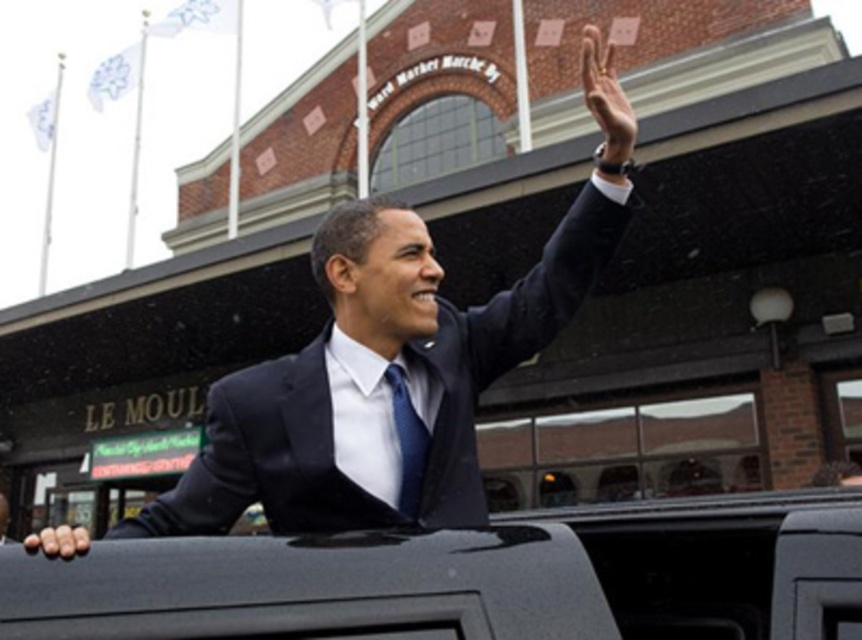
Does black matte suit at center lie behind black smooth suit at upper right?

That is True.

Is black matte suit at center above black smooth suit at upper right?

Incorrect, black matte suit at center is not positioned above black smooth suit at upper right.

Between point (205, 486) and point (564, 241), which one is positioned behind?

The point (564, 241) is behind.

The width and height of the screenshot is (862, 640). In order to click on black matte suit at center in this screenshot , I will do `click(380, 381)`.

Which of these two, black matte suit at center or black matte hand at lower left, stands taller?

Standing taller between the two is black matte hand at lower left.

Identify the location of black matte suit at center. The image size is (862, 640). (380, 381).

Which is behind, point (495, 358) or point (61, 552)?

The point (495, 358) is more distant.

Find the location of a particular element. This screenshot has width=862, height=640. black matte suit at center is located at coordinates (380, 381).

Is black matte suit at center above smooth skin hand at upper right?

No, black matte suit at center is not above smooth skin hand at upper right.

Is point (588, 208) in front of point (622, 145)?

No.

Which is in front, point (317, 460) or point (590, 61)?

Point (317, 460) is more forward.

You are a GUI agent. You are given a task and a screenshot of the screen. Output one action in this format:
    pyautogui.click(x=<x>, y=<y>)
    Task: Click on the black matte suit at center
    
    Given the screenshot: What is the action you would take?
    pyautogui.click(x=380, y=381)